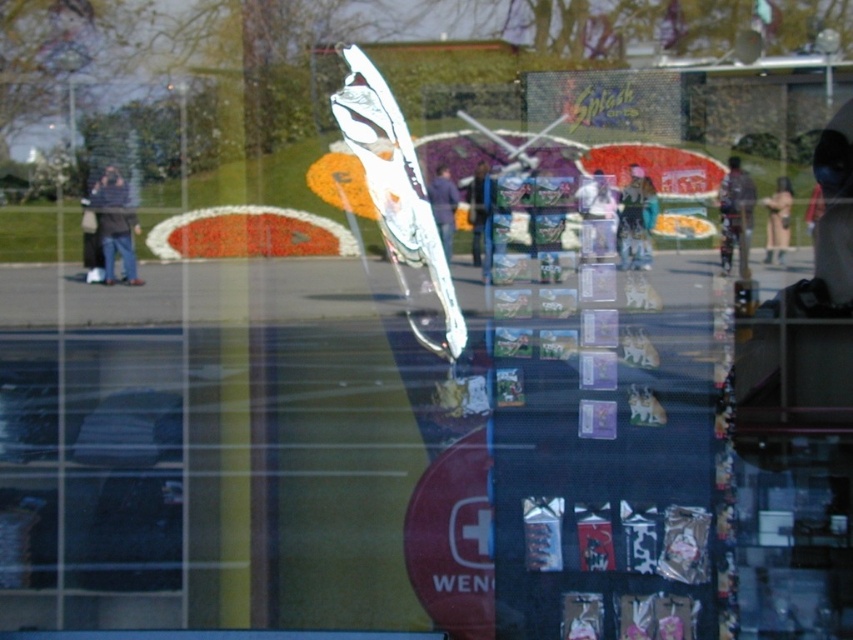
Does dark blue jeans at center appear on the left side of dark blue jeans at left?

No, dark blue jeans at center is not to the left of dark blue jeans at left.

Does dark blue jeans at center appear on the right side of dark blue jeans at left?

Correct, you'll find dark blue jeans at center to the right of dark blue jeans at left.

In order to click on dark blue jeans at center in this screenshot , I will do `click(444, 205)`.

Is blue denim jeans at center thinner than dark blue jeans at left?

In fact, blue denim jeans at center might be wider than dark blue jeans at left.

Between blue denim jeans at center and dark blue jeans at left, which one is positioned higher?

blue denim jeans at center is above.

The image size is (853, 640). In order to click on blue denim jeans at center in this screenshot , I will do `click(477, 211)`.

Does camouflage jacket at right have a lesser width compared to dark blue jeans at center?

In fact, camouflage jacket at right might be wider than dark blue jeans at center.

Does camouflage jacket at right have a smaller size compared to dark blue jeans at center?

Incorrect, camouflage jacket at right is not smaller in size than dark blue jeans at center.

In order to click on camouflage jacket at right in this screenshot , I will do `click(734, 209)`.

At what (x,y) coordinates should I click in order to perform the action: click on camouflage jacket at right. Please return your answer as a coordinate pair (x, y). Image resolution: width=853 pixels, height=640 pixels. Looking at the image, I should click on (734, 209).